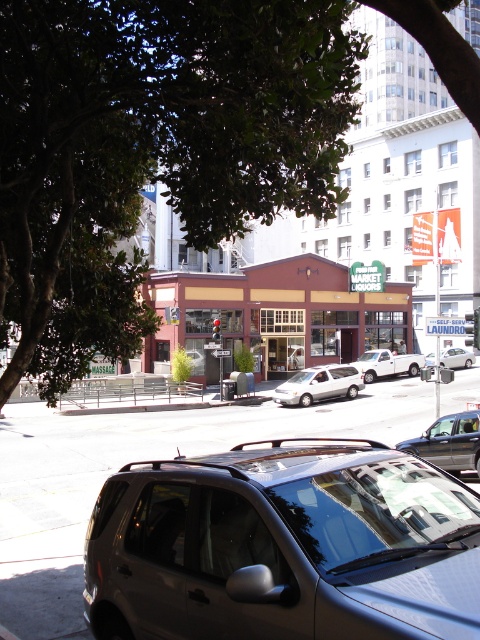
Who is lower down, green leafy tree at upper left or white matte truck at center?

white matte truck at center is below.

Is green leafy tree at upper left taller than white matte truck at center?

In fact, green leafy tree at upper left may be shorter than white matte truck at center.

Who is more distant from viewer, (66, 349) or (365, 353)?

Positioned behind is point (365, 353).

Locate an element on the screen. green leafy tree at upper left is located at coordinates (152, 147).

Is metallic silver sedan at center closer to camera compared to white matte minivan at center?

Yes, metallic silver sedan at center is in front of white matte minivan at center.

Who is positioned more to the right, metallic silver sedan at center or white matte minivan at center?

white matte minivan at center is more to the right.

The height and width of the screenshot is (640, 480). What do you see at coordinates (448, 442) in the screenshot?
I see `metallic silver sedan at center` at bounding box center [448, 442].

This screenshot has width=480, height=640. In order to click on metallic silver sedan at center in this screenshot , I will do `click(448, 442)`.

Is green leafy tree at upper left smaller than white matte minivan at center?

Correct, green leafy tree at upper left occupies less space than white matte minivan at center.

Is point (311, 124) positioned behind point (347, 385)?

No, it is in front of (347, 385).

Locate an element on the screen. The width and height of the screenshot is (480, 640). green leafy tree at upper left is located at coordinates (152, 147).